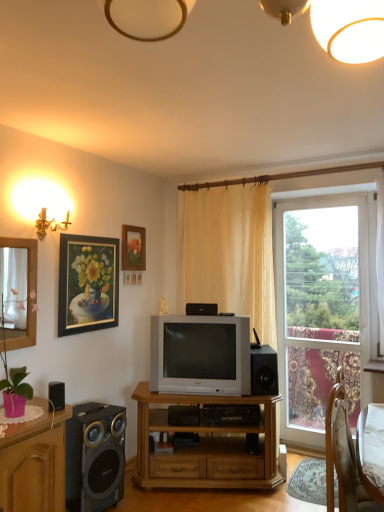
Question: From the image's perspective, relative to black plastic speaker at center, which is the first speaker from top to bottom, is wooden tv stand at center above or below?

Choices:
 (A) above
 (B) below

Answer: (B)

Question: In terms of height, does wooden tv stand at center look taller or shorter compared to black plastic speaker at center, the fourth speaker from the bottom?

Choices:
 (A) short
 (B) tall

Answer: (B)

Question: Considering the real-world distances, which object is closest to the clear glass window at right?

Choices:
 (A) gold-framed painting at upper left, the 1th picture frame when ordered from front to back
 (B) wooden tv stand at center
 (C) wooden cabinet at lower left
 (D) black matte speaker at lower left, placed as the third speaker when sorted from right to left
 (E) black matte speaker at lower left, the first speaker viewed from the front

Answer: (B)

Question: Considering the real-world distances, which object is closest to the beige fabric curtain at center?

Choices:
 (A) black matte speaker at lower right, acting as the second speaker starting from the bottom
 (B) matte wooden picture frame at upper center, the first picture frame positioned from the back
 (C) wooden chair with white cushion at lower right
 (D) black plastic speaker at center, which is the 1th speaker in back-to-front order
 (E) wooden cabinet at lower left

Answer: (D)